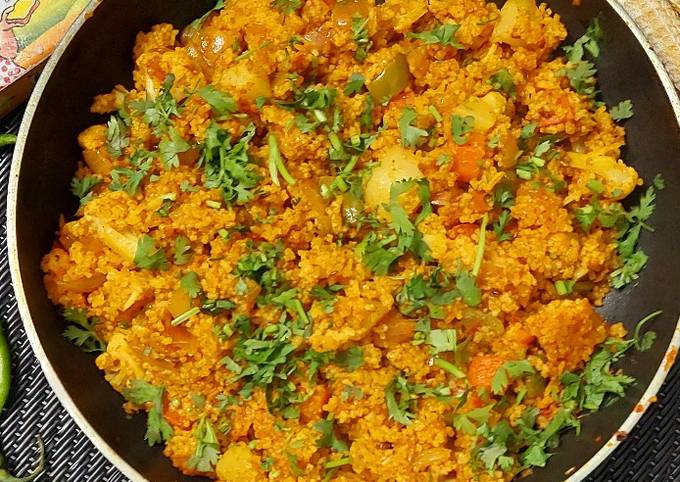
Find the location of a particular element. Image resolution: width=680 pixels, height=482 pixels. oven mit is located at coordinates (660, 39).